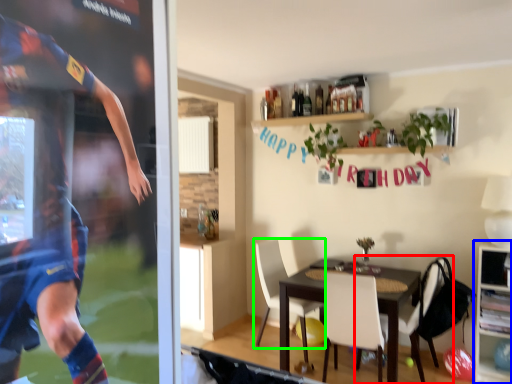
Question: Estimate the real-world distances between objects in this image. Which object is closer to chair (highlighted by a red box), cabinetry (highlighted by a blue box) or chair (highlighted by a green box)?

Choices:
 (A) cabinetry
 (B) chair

Answer: (A)